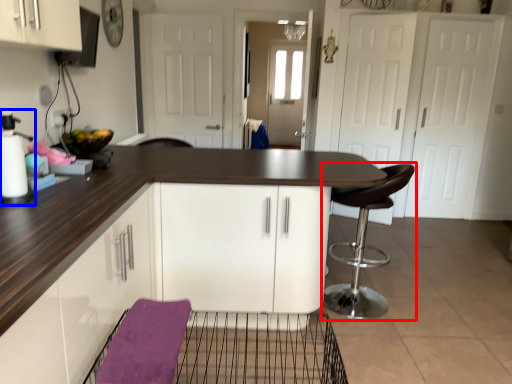
Question: Which object is further to the camera taking this photo, chair (highlighted by a red box) or appliance (highlighted by a blue box)?

Choices:
 (A) chair
 (B) appliance

Answer: (A)